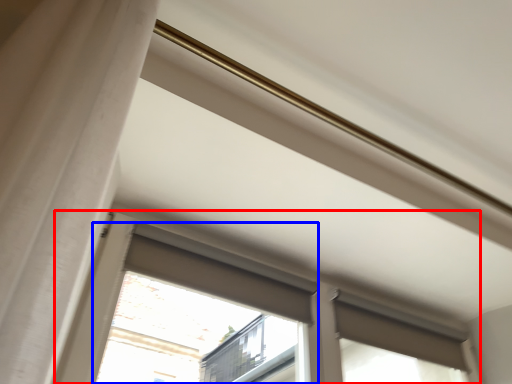
Question: Which object is closer to the camera taking this photo, window (highlighted by a red box) or bay window (highlighted by a blue box)?

Choices:
 (A) window
 (B) bay window

Answer: (A)